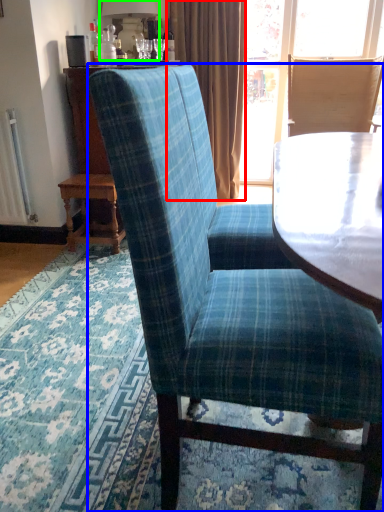
Question: Estimate the real-world distances between objects in this image. Which object is closer to curtain (highlighted by a red box), chair (highlighted by a blue box) or lamp (highlighted by a green box)?

Choices:
 (A) chair
 (B) lamp

Answer: (B)